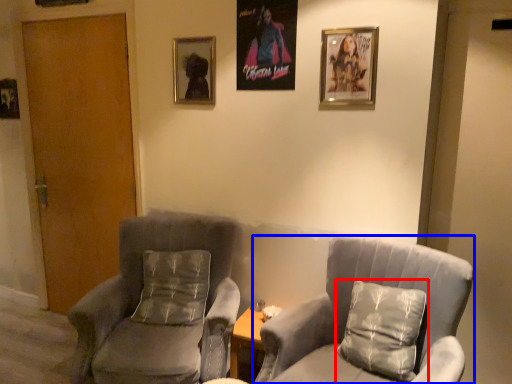
Question: Which object is closer to the camera taking this photo, pillow (highlighted by a red box) or chair (highlighted by a blue box)?

Choices:
 (A) pillow
 (B) chair

Answer: (B)